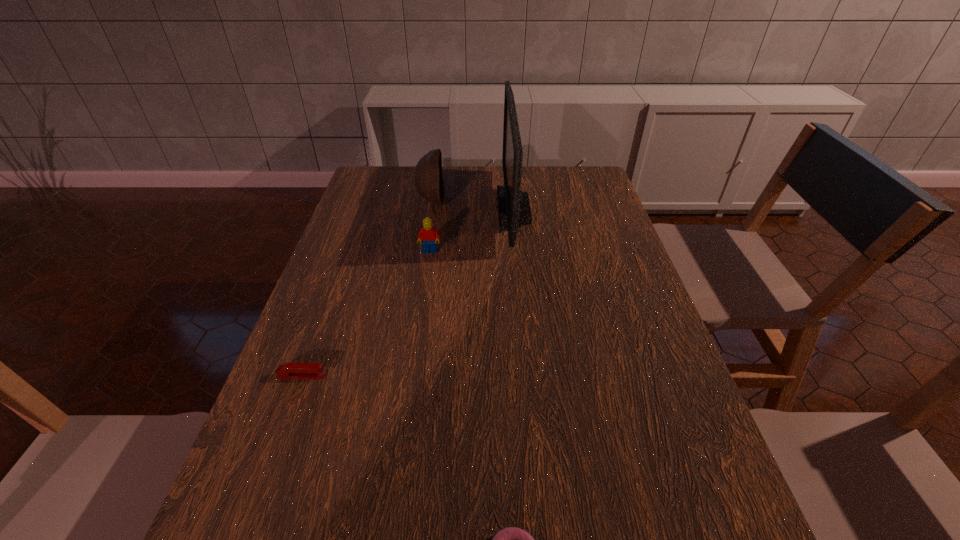
Where is `the tallest object`? the tallest object is located at coordinates (514, 211).

The height and width of the screenshot is (540, 960). Find the location of `bowl`. bowl is located at coordinates (429, 182).

Find the location of a particular element. The width and height of the screenshot is (960, 540). the third tallest object is located at coordinates (430, 236).

Locate an element on the screen. stapler is located at coordinates (287, 370).

This screenshot has width=960, height=540. I want to click on the leftmost object, so click(x=287, y=370).

This screenshot has width=960, height=540. I want to click on blank space located 0.130m on the screen side of the monitor, so click(458, 210).

This screenshot has width=960, height=540. I want to click on vacant area situated 0.380m on the screen side of the monitor, so click(x=381, y=210).

Identify the location of free region located on the screen side of the monitor. (480, 210).

At what (x,y) coordinates should I click in order to perform the action: click on free space located on the back of the second tallest object. Please return your answer as a coordinate pair (x, y). This screenshot has height=540, width=960. Looking at the image, I should click on (435, 181).

In order to click on free space located 0.330m on the face of the third shortest object in this screenshot , I will do `click(417, 346)`.